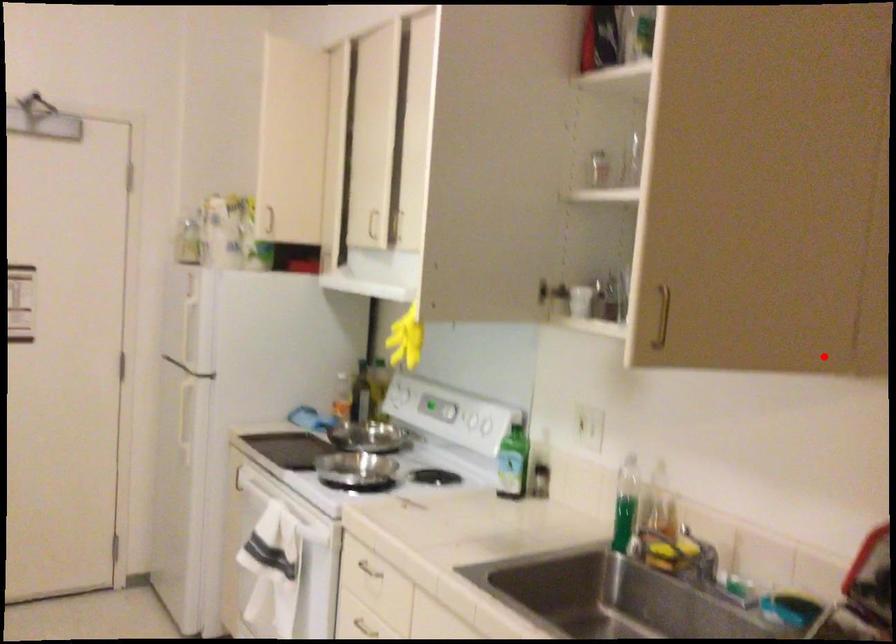
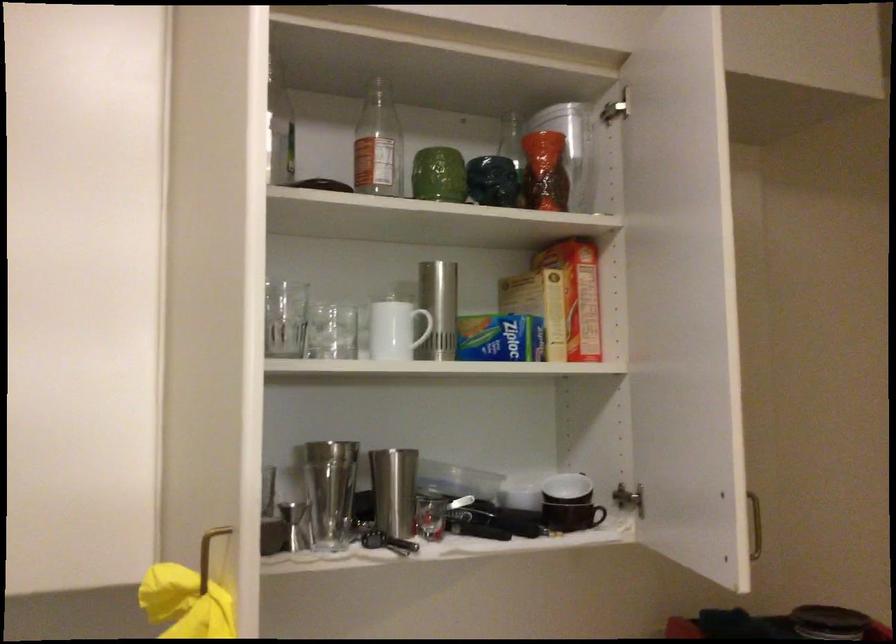
The point at the highlighted location is marked in the first image. Where is the corresponding point in the second image?

(591, 516)